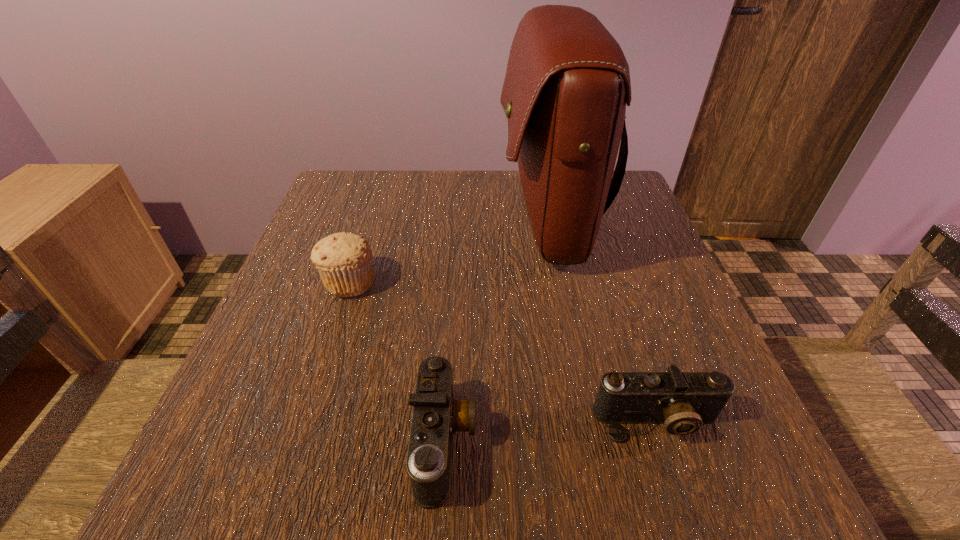
In the image, there is a desktop. Identify the location of vacant area at the right edge. pos(646,296).

This screenshot has width=960, height=540. In the image, there is a desktop. Find the location of `free space at the far left corner`. free space at the far left corner is located at coordinates (322, 208).

Find the location of a particular element. This screenshot has width=960, height=540. vacant space at the near left corner is located at coordinates (172, 502).

This screenshot has width=960, height=540. What are the coordinates of `vacant space that is in between the second object from left to right and the right camera` in the screenshot? It's located at (551, 431).

At what (x,y) coordinates should I click in order to perform the action: click on free spot between the right camera and the left camera. Please return your answer as a coordinate pair (x, y). Looking at the image, I should click on (551, 431).

You are a GUI agent. You are given a task and a screenshot of the screen. Output one action in this format:
    pyautogui.click(x=<x>, y=<y>)
    Task: Click on the free area in between the third shortest object and the second object from left to right
    This screenshot has width=960, height=540.
    Given the screenshot: What is the action you would take?
    pyautogui.click(x=397, y=362)

Identify the location of empty location between the satchel and the second tallest object. The height and width of the screenshot is (540, 960). (448, 252).

You are a GUI agent. You are given a task and a screenshot of the screen. Output one action in this format:
    pyautogui.click(x=<x>, y=<y>)
    Task: Click on the unoccupied position between the muffin and the right camera
    This screenshot has width=960, height=540.
    Given the screenshot: What is the action you would take?
    pyautogui.click(x=503, y=352)

What are the coordinates of `unoccupied area between the tallest object and the left camera` in the screenshot? It's located at tap(495, 331).

Find the location of a particular element. This screenshot has height=540, width=960. free spot between the right camera and the second object from left to right is located at coordinates (551, 431).